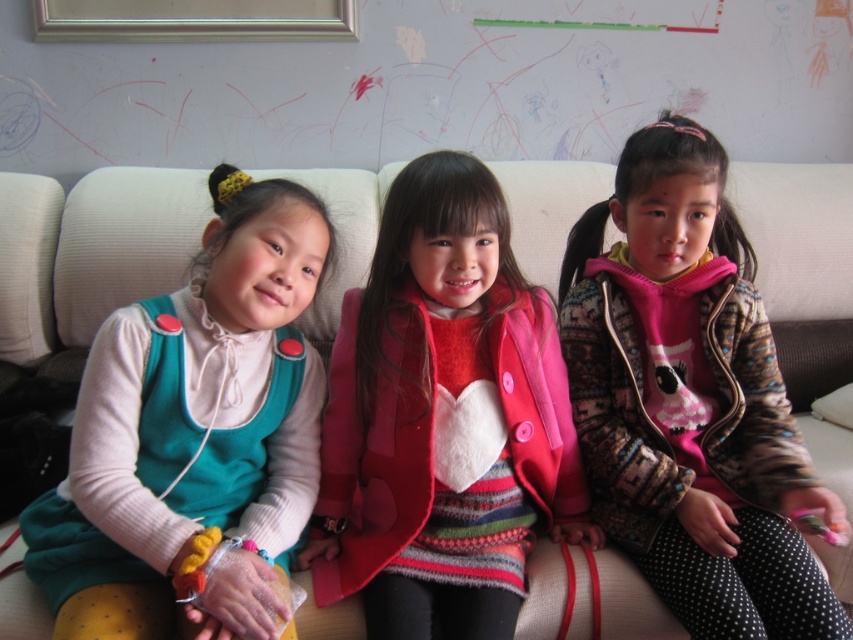
Can you confirm if matte pink coat at center is positioned below teal jersey at left?

No, matte pink coat at center is not below teal jersey at left.

The width and height of the screenshot is (853, 640). What do you see at coordinates (444, 419) in the screenshot?
I see `matte pink coat at center` at bounding box center [444, 419].

Identify the location of matte pink coat at center. (444, 419).

Consider the image. Who is positioned more to the right, pink fuzzy sweater at center or teal jersey at left?

From the viewer's perspective, pink fuzzy sweater at center appears more on the right side.

Is the position of pink fuzzy sweater at center less distant than that of teal jersey at left?

No, pink fuzzy sweater at center is further to the viewer.

Is point (819, 636) closer to camera compared to point (221, 420)?

Yes.

This screenshot has height=640, width=853. Identify the location of pink fuzzy sweater at center. (689, 400).

In the scene shown: Does matte pink coat at center appear on the left side of pink fuzzy sweater at center?

Yes, matte pink coat at center is to the left of pink fuzzy sweater at center.

Which is more to the left, matte pink coat at center or pink fuzzy sweater at center?

matte pink coat at center

Who is more forward, (495, 416) or (628, 266)?

Point (495, 416) is in front.

Find the location of a particular element. Image resolution: width=853 pixels, height=640 pixels. matte pink coat at center is located at coordinates (444, 419).